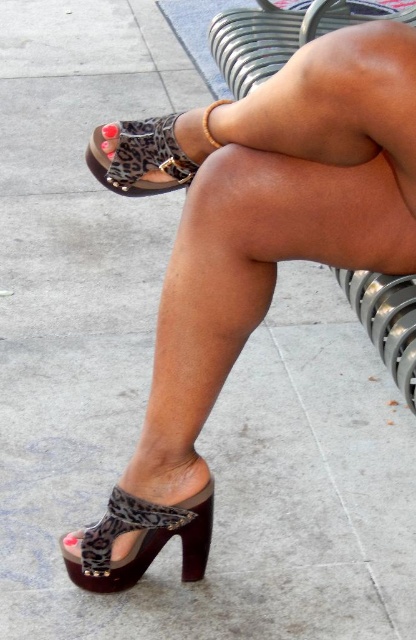
Does leopard print sandal at lower center have a larger size compared to leopard print fabric sandal at lower left?

Indeed, leopard print sandal at lower center has a larger size compared to leopard print fabric sandal at lower left.

Looking at this image, is leopard print sandal at lower center to the right of leopard print fabric sandal at lower left from the viewer's perspective?

Correct, you'll find leopard print sandal at lower center to the right of leopard print fabric sandal at lower left.

Where is `leopard print sandal at lower center`? leopard print sandal at lower center is located at coordinates (151, 152).

Is leopard print sandal at lower center below leopard print sandal at lower left?

Incorrect, leopard print sandal at lower center is not positioned below leopard print sandal at lower left.

Can you confirm if leopard print sandal at lower center is wider than leopard print sandal at lower left?

Indeed, leopard print sandal at lower center has a greater width compared to leopard print sandal at lower left.

Is point (185, 147) more distant than point (171, 166)?

No.

You are a GUI agent. You are given a task and a screenshot of the screen. Output one action in this format:
    pyautogui.click(x=<x>, y=<y>)
    Task: Click on the leopard print sandal at lower center
    
    Given the screenshot: What is the action you would take?
    pyautogui.click(x=151, y=152)

Between point (210, 508) and point (136, 176), which one is positioned in front?

Point (136, 176) is more forward.

Find the location of a particular element. leopard print fabric sandal at lower left is located at coordinates (140, 540).